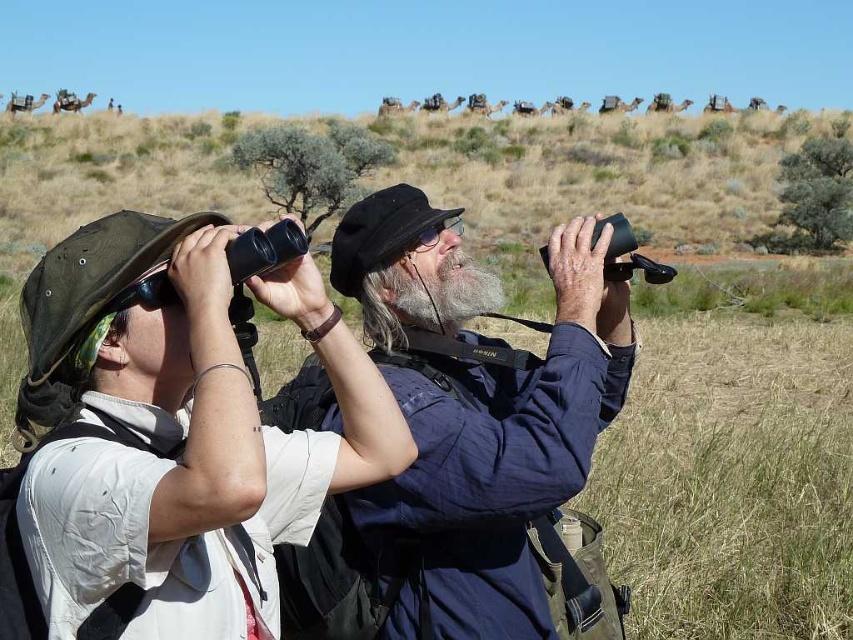
You are standing at the point with coordinates point (387, 472) and want to move towards the point (389, 532). Based on the scene, will you be moving towards the background or the foreground?

Since point (387, 472) is in front of point (389, 532), moving from point (387, 472) towards point (389, 532) would mean moving towards the background.

You are a hiker who needs to place a 70 cm long hiking pole between the matte black binoculars at left and the graywoollybeard at center. Can the pole fit between them?

The distance between the matte black binoculars at left and the graywoollybeard at center is 78.09 centimeters, which is greater than the 70 cm length of the pole. Therefore, the pole can fit between them.

You are a photographer trying to capture a distant bird. You have two binoculars available in the scene. The person on the left has matte black binoculars at left, and the person on the right has another pair. If you want to use the binoculars closer to the center of the image, which one should you choose?

The matte black binoculars at left are located at point [167,440], which is closer to the center of the image compared to the other binoculars. Therefore, you should choose the matte black binoculars at left.